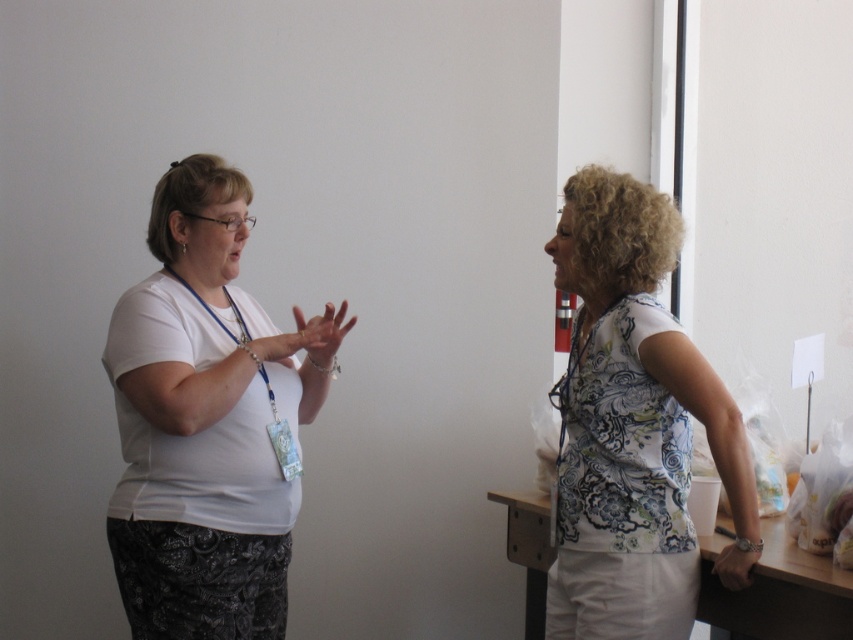
Who is more forward, (209,296) or (656,467)?

Positioned in front is point (656,467).

Is point (260, 356) positioned after point (672, 627)?

Yes, it is behind point (672, 627).

Where is `white matte shirt at center`? white matte shirt at center is located at coordinates (206, 420).